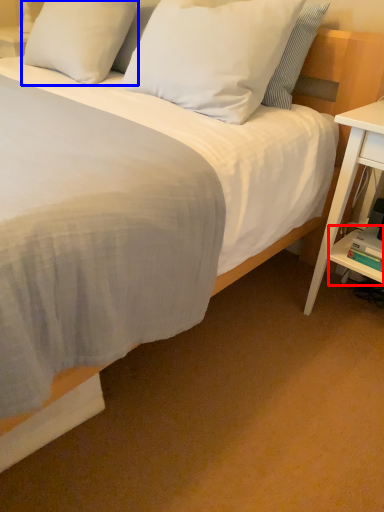
Question: Among these objects, which one is farthest to the camera, shelf (highlighted by a red box) or pillow (highlighted by a blue box)?

Choices:
 (A) shelf
 (B) pillow

Answer: (B)